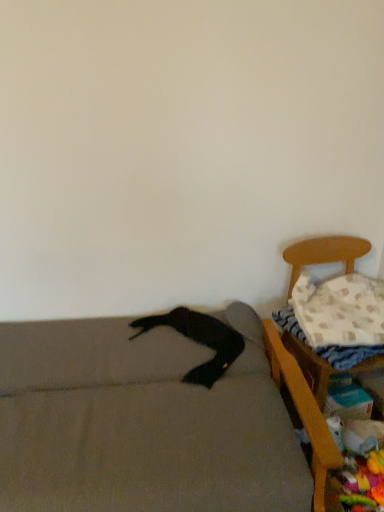
Where is `soft gray couch at lower left, which appears as the first furniture when viewed from the left`? The image size is (384, 512). soft gray couch at lower left, which appears as the first furniture when viewed from the left is located at coordinates (148, 423).

Image resolution: width=384 pixels, height=512 pixels. What do you see at coordinates (347, 355) in the screenshot? I see `white textured blanket at right` at bounding box center [347, 355].

At what (x,y) coordinates should I click in order to perform the action: click on white textured pillow at right. Please return your answer as a coordinate pair (x, y). Looking at the image, I should click on (340, 310).

Where is `soft gray couch at lower left, arranged as the 2th furniture when viewed from the right`? soft gray couch at lower left, arranged as the 2th furniture when viewed from the right is located at coordinates (148, 423).

Between soft gray couch at lower left, which appears as the first furniture when viewed from the left, and white textured blanket at right, which one has larger width?

Wider between the two is soft gray couch at lower left, which appears as the first furniture when viewed from the left.

Considering the relative positions of soft gray couch at lower left, which appears as the first furniture when viewed from the left, and white textured blanket at right in the image provided, is soft gray couch at lower left, which appears as the first furniture when viewed from the left, to the right of white textured blanket at right from the viewer's perspective?

No, soft gray couch at lower left, which appears as the first furniture when viewed from the left, is not to the right of white textured blanket at right.

Is soft gray couch at lower left, arranged as the 2th furniture when viewed from the right, bigger than white textured blanket at right?

Indeed, soft gray couch at lower left, arranged as the 2th furniture when viewed from the right, has a larger size compared to white textured blanket at right.

Can you confirm if white textured pillow at right is smaller than soft gray couch at lower left, which appears as the first furniture when viewed from the left?

Indeed, white textured pillow at right has a smaller size compared to soft gray couch at lower left, which appears as the first furniture when viewed from the left.

From a real-world perspective, is white textured pillow at right positioned above or below soft gray couch at lower left, which appears as the first furniture when viewed from the left?

white textured pillow at right is situated higher than soft gray couch at lower left, which appears as the first furniture when viewed from the left, in the real world.

Which is in front, point (340, 317) or point (188, 434)?

Point (188, 434)

From the image's perspective, between white textured pillow at right and soft gray couch at lower left, arranged as the 2th furniture when viewed from the right, who is located below?

soft gray couch at lower left, arranged as the 2th furniture when viewed from the right, appears lower in the image.

Between black fabric pants at lower left and soft gray couch at lower left, arranged as the 2th furniture when viewed from the right, which one has less height?

With less height is black fabric pants at lower left.

Considering the relative positions of black fabric pants at lower left and soft gray couch at lower left, arranged as the 2th furniture when viewed from the right, in the image provided, is black fabric pants at lower left to the left or to the right of soft gray couch at lower left, arranged as the 2th furniture when viewed from the right,?

In the image, black fabric pants at lower left appears on the right side of soft gray couch at lower left, arranged as the 2th furniture when viewed from the right.

From a real-world perspective, which is physically above, black fabric pants at lower left or soft gray couch at lower left, arranged as the 2th furniture when viewed from the right?

black fabric pants at lower left is physically above.

Is black fabric pants at lower left turned away from soft gray couch at lower left, arranged as the 2th furniture when viewed from the right?

Yes, black fabric pants at lower left's orientation is away from soft gray couch at lower left, arranged as the 2th furniture when viewed from the right.

You are a GUI agent. You are given a task and a screenshot of the screen. Output one action in this format:
    pyautogui.click(x=<x>, y=<y>)
    Task: Click on the clothing located above the wooden chair at right, which is counted as the second furniture, starting from the left (from the image's perspective)
    The image size is (384, 512).
    Given the screenshot: What is the action you would take?
    pyautogui.click(x=199, y=341)

Is black fabric pants at lower left facing away from wooden chair at right, which is the 1th furniture in right-to-left order?

black fabric pants at lower left does not have its back to wooden chair at right, which is the 1th furniture in right-to-left order.

Considering the positions of points (217, 375) and (304, 378), is point (217, 375) closer to camera compared to point (304, 378)?

Yes, point (217, 375) is closer to viewer.

Between black fabric pants at lower left and wooden chair at right, which is counted as the second furniture, starting from the left, which one has larger size?

With larger size is wooden chair at right, which is counted as the second furniture, starting from the left.

Which object is wider, wooden chair at right, which is the 1th furniture in right-to-left order, or white textured blanket at right?

wooden chair at right, which is the 1th furniture in right-to-left order, is wider.

Would you say wooden chair at right, which is the 1th furniture in right-to-left order, is inside or outside white textured blanket at right?

wooden chair at right, which is the 1th furniture in right-to-left order, is located beyond the bounds of white textured blanket at right.

Which is closer, (320, 506) or (281, 318)?

The point (320, 506) is closer.

Looking at the image, does wooden chair at right, which is counted as the second furniture, starting from the left, seem bigger or smaller compared to white textured blanket at right?

Considering their sizes, wooden chair at right, which is counted as the second furniture, starting from the left, takes up more space than white textured blanket at right.

Consider the image. Which object is closer to the camera, black fabric pants at lower left or white textured pillow at right?

black fabric pants at lower left is in front.

From a real-world perspective, who is located lower, black fabric pants at lower left or white textured pillow at right?

black fabric pants at lower left is physically lower.

Find the location of a particular element. The height and width of the screenshot is (512, 384). pillow above the black fabric pants at lower left (from a real-world perspective) is located at coordinates (340, 310).

From the image's perspective, does soft gray couch at lower left, arranged as the 2th furniture when viewed from the right, appear higher than white textured pillow at right?

Incorrect, from the image's perspective, soft gray couch at lower left, arranged as the 2th furniture when viewed from the right, is lower than white textured pillow at right.

From a real-world perspective, between soft gray couch at lower left, arranged as the 2th furniture when viewed from the right, and white textured pillow at right, who is vertically higher?

white textured pillow at right is physically above.

Which of these two, soft gray couch at lower left, arranged as the 2th furniture when viewed from the right, or white textured pillow at right, is thinner?

With smaller width is white textured pillow at right.

Is soft gray couch at lower left, arranged as the 2th furniture when viewed from the right, outside of white textured pillow at right?

That's correct, soft gray couch at lower left, arranged as the 2th furniture when viewed from the right, is outside of white textured pillow at right.

From the white textured blanket at right, count 2nd furnitures forward and point to it. Please provide its 2D coordinates.

[(148, 423)]

Locate an element on the screen. This screenshot has width=384, height=512. the 2nd furniture below the white textured pillow at right (from the image's perspective) is located at coordinates (148, 423).

Considering their positions, is wooden chair at right, which is the 1th furniture in right-to-left order, positioned closer to soft gray couch at lower left, arranged as the 2th furniture when viewed from the right, than white textured blanket at right?

Among the two, wooden chair at right, which is the 1th furniture in right-to-left order, is located nearer to soft gray couch at lower left, arranged as the 2th furniture when viewed from the right.

From the image, which object appears to be nearer to soft gray couch at lower left, arranged as the 2th furniture when viewed from the right, black fabric pants at lower left or white textured pillow at right?

black fabric pants at lower left.

Considering their positions, is wooden chair at right, which is counted as the second furniture, starting from the left, positioned further to soft gray couch at lower left, which appears as the first furniture when viewed from the left, than white textured pillow at right?

The object further to soft gray couch at lower left, which appears as the first furniture when viewed from the left, is white textured pillow at right.

When comparing their distances from black fabric pants at lower left, does soft gray couch at lower left, which appears as the first furniture when viewed from the left, or white textured pillow at right seem closer?

Among the two, soft gray couch at lower left, which appears as the first furniture when viewed from the left, is located nearer to black fabric pants at lower left.

Based on their spatial positions, is white textured pillow at right or white textured blanket at right closer to soft gray couch at lower left, which appears as the first furniture when viewed from the left?

Among the two, white textured pillow at right is located nearer to soft gray couch at lower left, which appears as the first furniture when viewed from the left.

In the scene shown: Based on their spatial positions, is soft gray couch at lower left, arranged as the 2th furniture when viewed from the right, or white textured blanket at right further from black fabric pants at lower left?

Based on the image, white textured blanket at right appears to be further to black fabric pants at lower left.

In the scene shown: Considering their positions, is soft gray couch at lower left, which appears as the first furniture when viewed from the left, positioned further to wooden chair at right, which is the 1th furniture in right-to-left order, than black fabric pants at lower left?

Among the two, soft gray couch at lower left, which appears as the first furniture when viewed from the left, is located further to wooden chair at right, which is the 1th furniture in right-to-left order.

Estimate the real-world distances between objects in this image. Which object is further from white textured pillow at right, white textured blanket at right or soft gray couch at lower left, arranged as the 2th furniture when viewed from the right?

soft gray couch at lower left, arranged as the 2th furniture when viewed from the right, is further to white textured pillow at right.

Find the location of a particular element. The width and height of the screenshot is (384, 512). clothing located between soft gray couch at lower left, which appears as the first furniture when viewed from the left, and wooden chair at right, which is counted as the second furniture, starting from the left, in the left-right direction is located at coordinates (199, 341).

You are a GUI agent. You are given a task and a screenshot of the screen. Output one action in this format:
    pyautogui.click(x=<x>, y=<y>)
    Task: Click on the sheet situated between soft gray couch at lower left, arranged as the 2th furniture when viewed from the right, and wooden chair at right, which is the 1th furniture in right-to-left order, from left to right
    
    Given the screenshot: What is the action you would take?
    pyautogui.click(x=347, y=355)

Find the location of a particular element. The image size is (384, 512). sheet between soft gray couch at lower left, which appears as the first furniture when viewed from the left, and white textured pillow at right, in the horizontal direction is located at coordinates (347, 355).

Where is `clothing situated between soft gray couch at lower left, which appears as the first furniture when viewed from the left, and white textured blanket at right from left to right`? Image resolution: width=384 pixels, height=512 pixels. clothing situated between soft gray couch at lower left, which appears as the first furniture when viewed from the left, and white textured blanket at right from left to right is located at coordinates (199, 341).